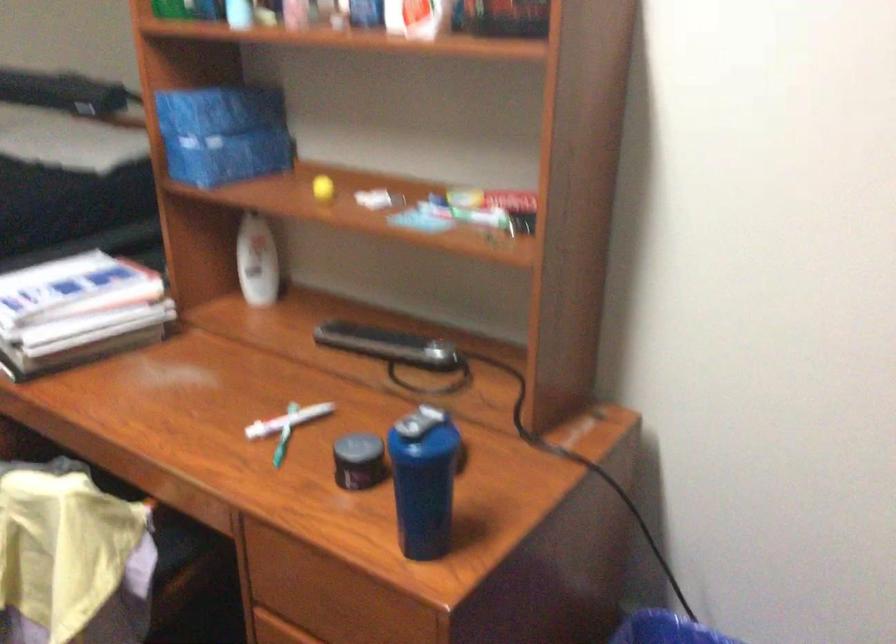
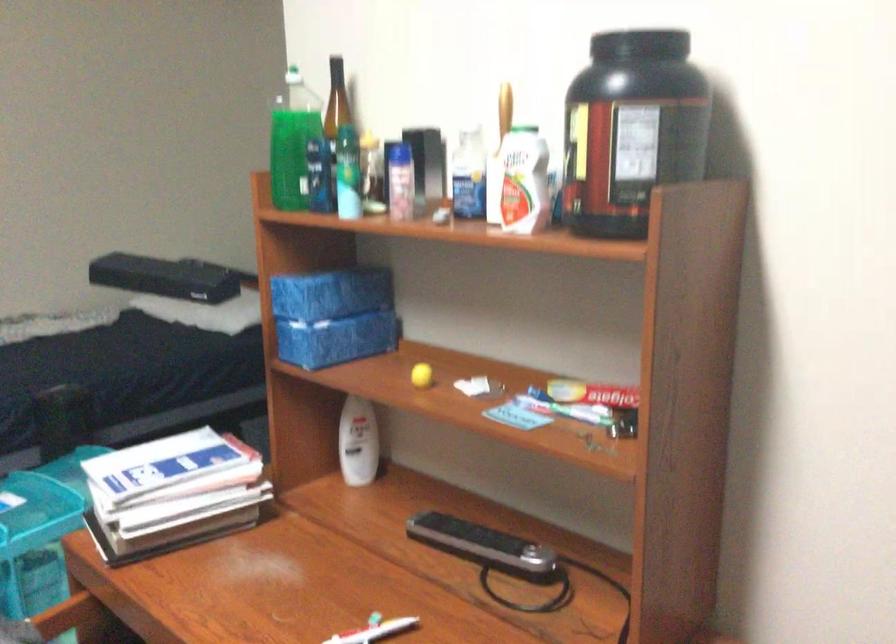
Which direction would the cameraman need to move to produce the second image?

The cameraman moved toward right, forward.